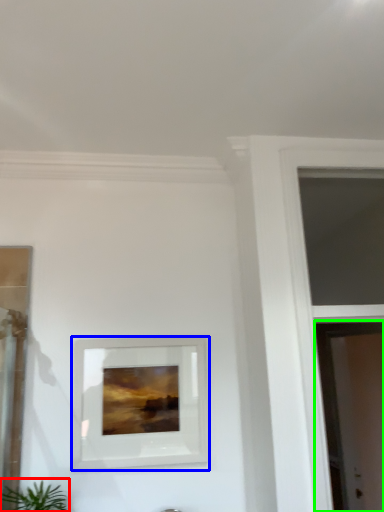
Question: Which object is positioned farthest from houseplant (highlighted by a red box)? Select from picture frame (highlighted by a blue box) and screen door (highlighted by a green box).

Choices:
 (A) picture frame
 (B) screen door

Answer: (B)